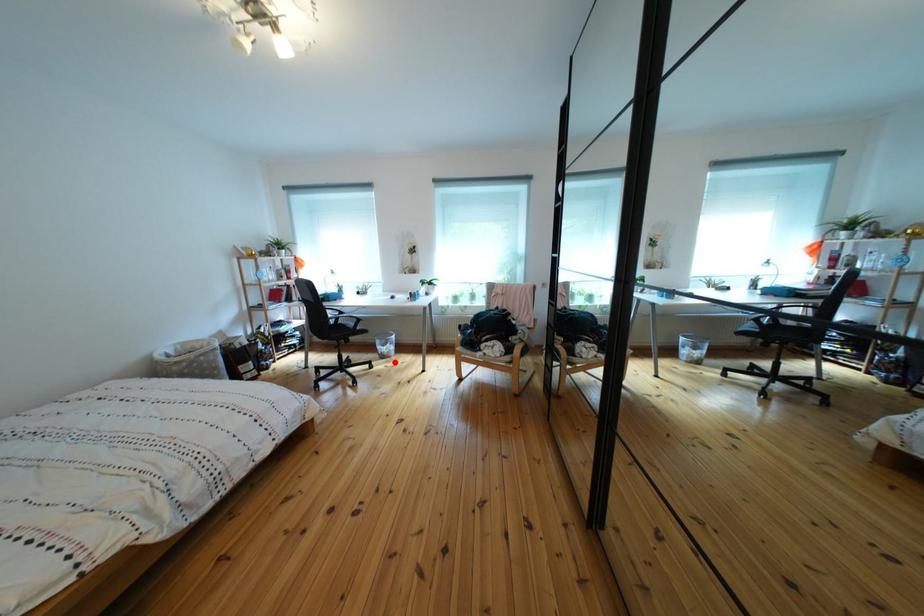
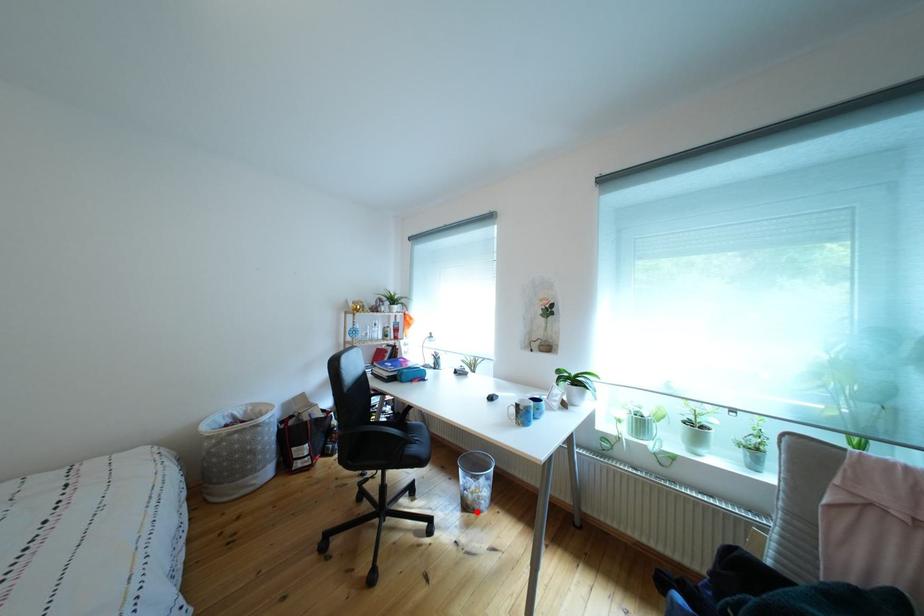
I am providing you with two images of the same scene from different viewpoints. A red point is marked on the first image and another point is marked on the second image. Is the red point in image1 aligned with the point shown in image2?

Yes